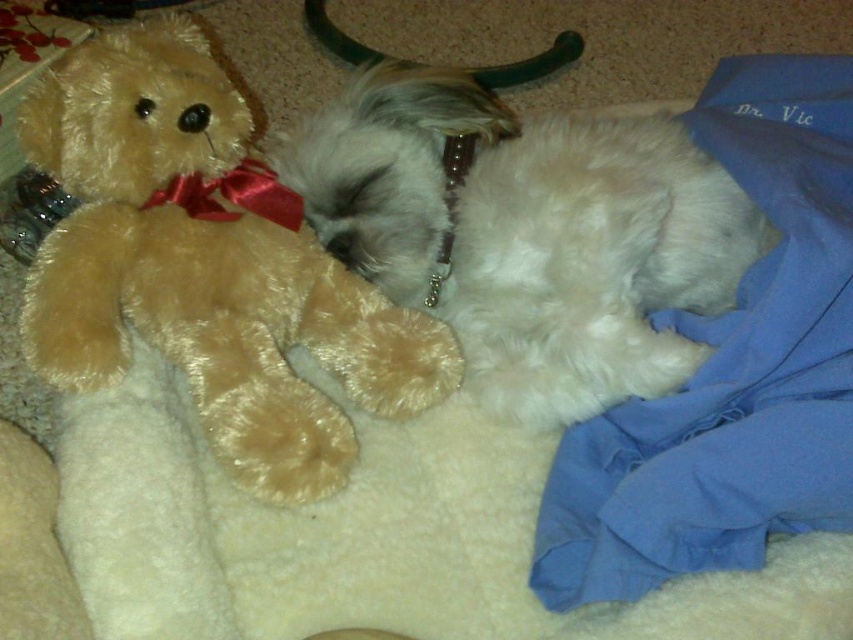
You are a photographer setting up a shoot in this scene. You want to position a small stool between the soft brown plush bear at left and the white fluffy dog at center. Based on their current positions, where should you place the stool to ensure it is between them?

The soft brown plush bear at left is to the left of the white fluffy dog at center, so placing the stool to the right of the bear and to the left of the dog would position it between them.

You are looking at the image and see two points marked in the scene. Which point, point (x=186, y=355) or point (x=682, y=268), is closer to you?

Point (x=186, y=355) is closer to you than point (x=682, y=268).

You are a photographer setting up a shot of the soft brown plush bear at left and the white fluffy dog at center. Which object should you adjust to ensure both fit within the frame, considering their sizes?

The soft brown plush bear at left has a lesser width compared to the white fluffy dog at center. To ensure both fit within the frame, you should adjust the position of the white fluffy dog at center since it is wider and may require more space.